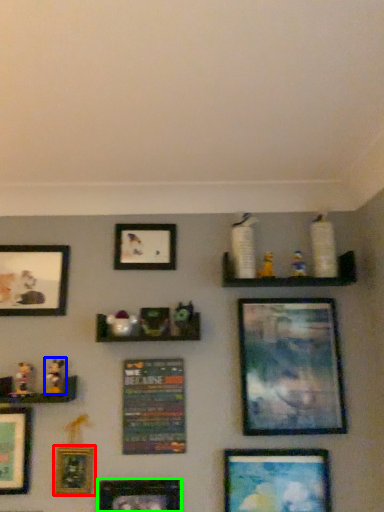
Question: Which is farther away from picture frame (highlighted by a red box)? toy (highlighted by a blue box) or picture frame (highlighted by a green box)?

Choices:
 (A) toy
 (B) picture frame

Answer: (A)